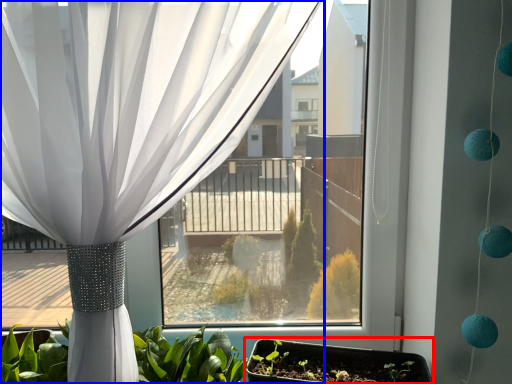
Question: Which object appears farthest to the camera in this image, flowerpot (highlighted by a red box) or curtain (highlighted by a blue box)?

Choices:
 (A) flowerpot
 (B) curtain

Answer: (A)